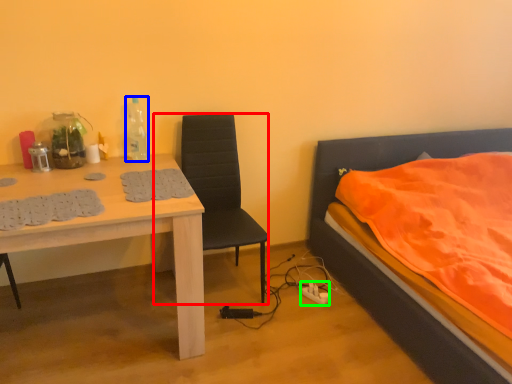
Question: Based on their relative distances, which object is farther from chair (highlighted by a red box)? Choose from bottle (highlighted by a blue box) and power outlet (highlighted by a green box).

Choices:
 (A) bottle
 (B) power outlet

Answer: (B)